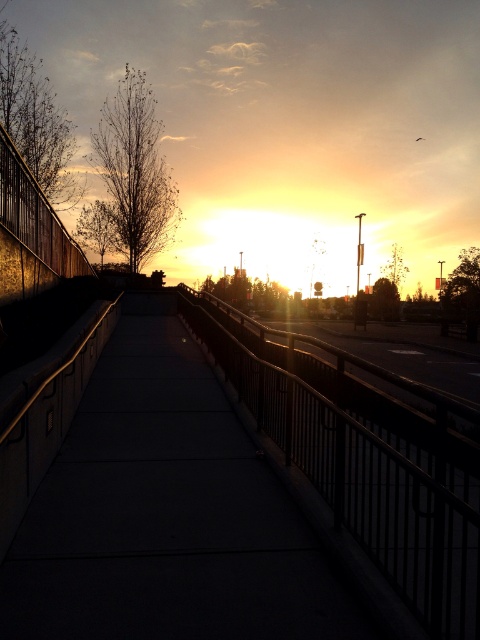
Who is more forward, (314, 624) or (286, 429)?

Positioned in front is point (314, 624).

You are a GUI agent. You are given a task and a screenshot of the screen. Output one action in this format:
    pyautogui.click(x=<x>, y=<y>)
    Task: Click on the concrete sidewalk at center
    
    Given the screenshot: What is the action you would take?
    pyautogui.click(x=166, y=513)